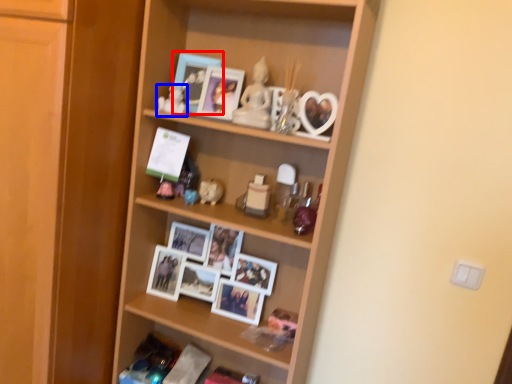
Question: Which of the following is the closest to the observer, picture frame (highlighted by a red box) or toy (highlighted by a blue box)?

Choices:
 (A) picture frame
 (B) toy

Answer: (B)